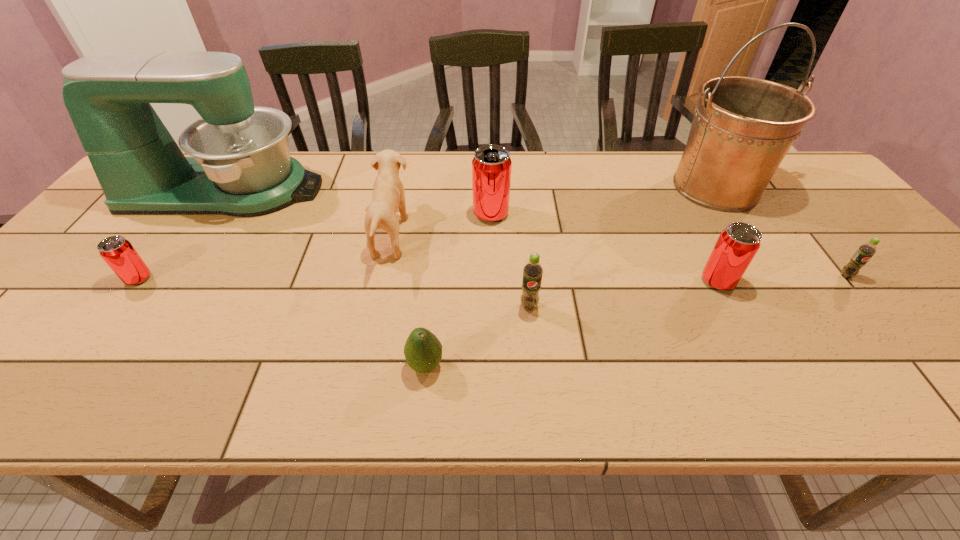
Identify which red soda can is the second nearest to the nearest object. Please provide its 2D coordinates. Your answer should be formatted as a tuple, i.e. [(x, y)], where the tuple contains the x and y coordinates of a point satisfying the conditions above.

[(737, 245)]

This screenshot has height=540, width=960. What are the coordinates of `red soda can that is the closest to the farther green soda` in the screenshot? It's located at (737, 245).

You are a GUI agent. You are given a task and a screenshot of the screen. Output one action in this format:
    pyautogui.click(x=<x>, y=<y>)
    Task: Click on the vacant area in the image that satisfies the following two spatial constraints: 1. on the left side of the seventh object from right to left; 2. on the right side of the rightmost red soda can
    
    Given the screenshot: What is the action you would take?
    pyautogui.click(x=381, y=281)

You are a GUI agent. You are given a task and a screenshot of the screen. Output one action in this format:
    pyautogui.click(x=<x>, y=<y>)
    Task: Click on the blank area in the image that satisfies the following two spatial constraints: 1. on the front-facing side of the second red soda can from right to left; 2. on the right side of the second tallest object
    This screenshot has width=960, height=540.
    Given the screenshot: What is the action you would take?
    pos(209,214)